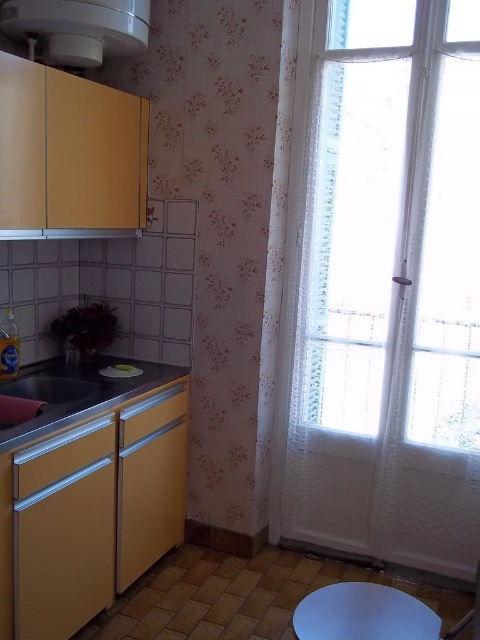
Between white glossy exhaust hood at upper left and metallic gray counter top at lower center, which one is positioned higher?

white glossy exhaust hood at upper left is higher up.

The image size is (480, 640). Find the location of `white glossy exhaust hood at upper left`. white glossy exhaust hood at upper left is located at coordinates (80, 28).

Looking at this image, which is above, white sheer curtain at right or white matte stool at lower center?

white sheer curtain at right is above.

Does white sheer curtain at right appear on the left side of white matte stool at lower center?

No, white sheer curtain at right is not to the left of white matte stool at lower center.

Between point (450, 260) and point (331, 595), which one is positioned behind?

The point (450, 260) is behind.

Identify the location of white sheer curtain at right. This screenshot has height=640, width=480. (384, 285).

Based on the photo, can you confirm if metallic gray counter top at lower center is positioned to the right of matte silver sink at lower left?

Indeed, metallic gray counter top at lower center is positioned on the right side of matte silver sink at lower left.

Between metallic gray counter top at lower center and matte silver sink at lower left, which one has less height?

Standing shorter between the two is matte silver sink at lower left.

At what (x,y) coordinates should I click in order to perform the action: click on metallic gray counter top at lower center. Please return your answer as a coordinate pair (x, y). The image size is (480, 640). Looking at the image, I should click on (75, 394).